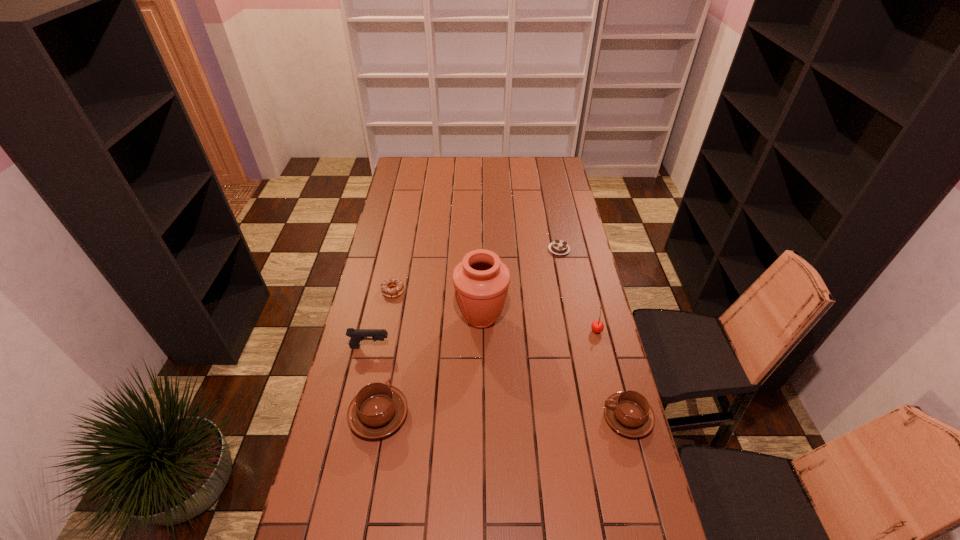
In the image, there is a desktop. Identify the location of vacant region at the near left corner. The width and height of the screenshot is (960, 540). (324, 501).

This screenshot has width=960, height=540. Identify the location of free space between the taller cappuccino and the fifth tallest object. (503, 416).

The height and width of the screenshot is (540, 960). I want to click on vacant area that lies between the tallest object and the third shortest object, so click(x=555, y=367).

At what (x,y) coordinates should I click in order to perform the action: click on free space between the cherry and the farthest object. Please return your answer as a coordinate pair (x, y). The image size is (960, 540). Looking at the image, I should click on (578, 289).

At what (x,y) coordinates should I click in order to perform the action: click on vacant point located between the second shortest object and the vase. Please return your answer as a coordinate pair (x, y). Looking at the image, I should click on (437, 304).

This screenshot has height=540, width=960. I want to click on vacant point located between the cherry and the pistol, so click(483, 339).

Where is `vacant point located between the shortest object and the vase`? This screenshot has height=540, width=960. vacant point located between the shortest object and the vase is located at coordinates (520, 284).

This screenshot has height=540, width=960. I want to click on free space between the shorter cappuccino and the farthest object, so click(593, 333).

Where is `vacant area between the doughnut and the pistol`? vacant area between the doughnut and the pistol is located at coordinates (381, 319).

Find the location of a particular element. empty space that is in between the chocolate cake and the cherry is located at coordinates (578, 289).